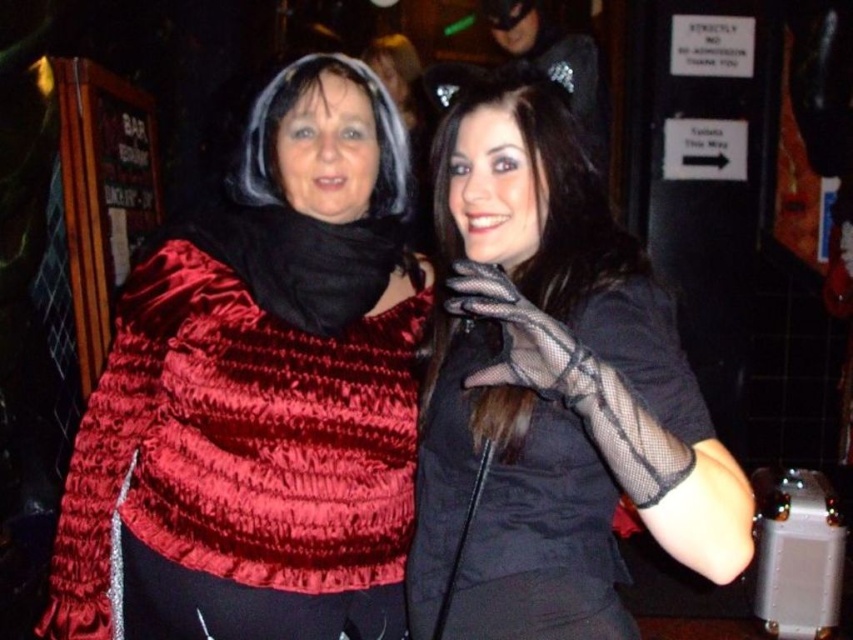
Which is behind, point (363, 154) or point (529, 444)?

The point (363, 154) is behind.

Is point (410, 496) less distant than point (532, 134)?

No, it is behind (532, 134).

Is point (231, 282) closer to viewer compared to point (492, 380)?

No, it is not.

Where is `velvet red cape at upper left`? This screenshot has height=640, width=853. velvet red cape at upper left is located at coordinates (259, 396).